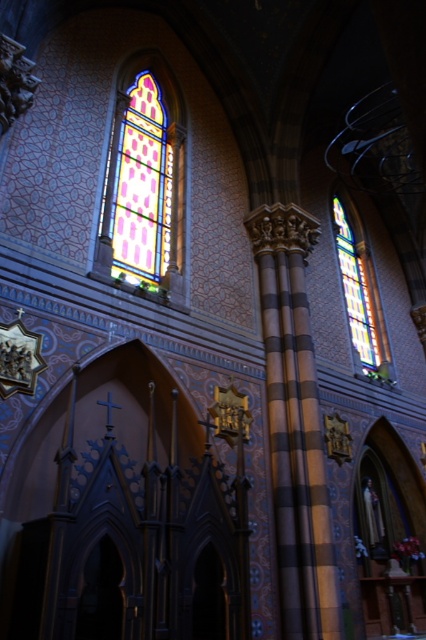
Does point (181, 161) lie in front of point (344, 250)?

Yes, it is.

The width and height of the screenshot is (426, 640). What are the coordinates of `stained glass window at upper left` in the screenshot? It's located at (144, 186).